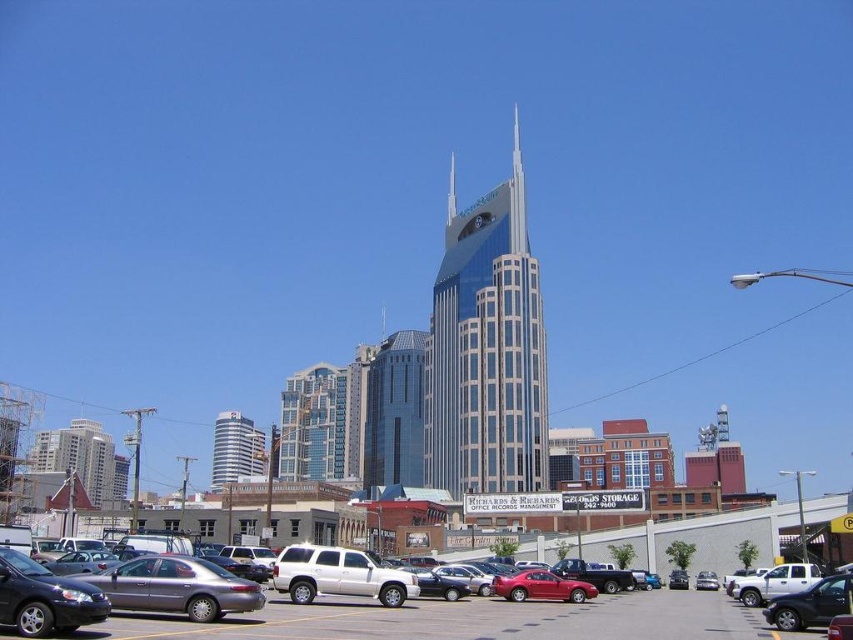
You are a city planner reviewing the urban layout. You notice the glass skyscraper at center and the white glossy building at center. Which one is placed higher in the image?

The glass skyscraper at center is positioned over the white glossy building at center, meaning it is higher up in the image.

You are a delivery driver who needs to park your metallic silver sedan at center in the gray asphalt parking lot at lower center. Can you fit your car into the parking space?

The gray asphalt parking lot at lower center is bigger than the metallic silver sedan at center, so yes, the metallic silver sedan at center can fit into the parking space.

You are standing in the parking lot of the skyscraper and want to walk from point A to point B. Point A is located at coordinates point (123, 620) and point B is at point (700, 586). Which point is closer to you when you start walking?

Point (123, 620) is closer to you than point (700, 586), so you will reach point A first before moving towards point B.